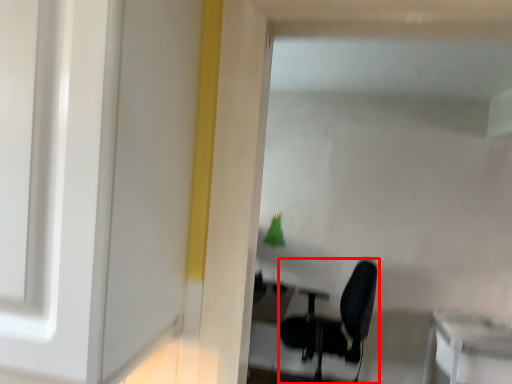
Question: Where is chair (annotated by the red box) located in relation to table in the image?

Choices:
 (A) right
 (B) left

Answer: (B)